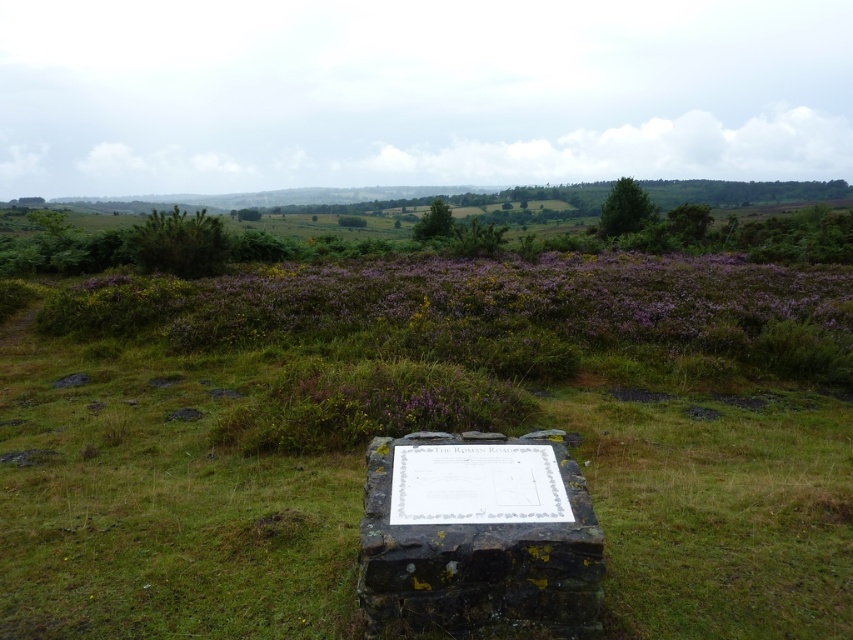
Who is shorter, purple matte heather at upper center or dark gray stone marker at center?

dark gray stone marker at center

Does purple matte heather at upper center appear under dark gray stone marker at center?

Actually, purple matte heather at upper center is above dark gray stone marker at center.

I want to click on purple matte heather at upper center, so click(x=465, y=300).